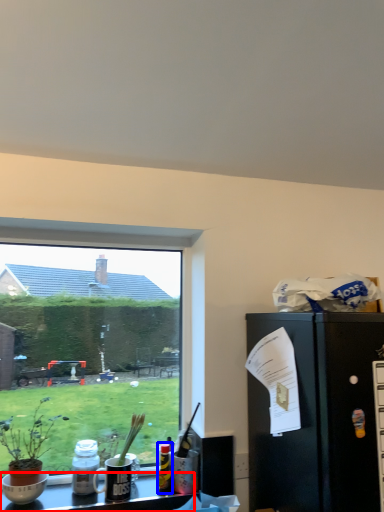
Question: Which of the following is the farthest to the observer, desk (highlighted by a red box) or bottle (highlighted by a blue box)?

Choices:
 (A) desk
 (B) bottle

Answer: (B)